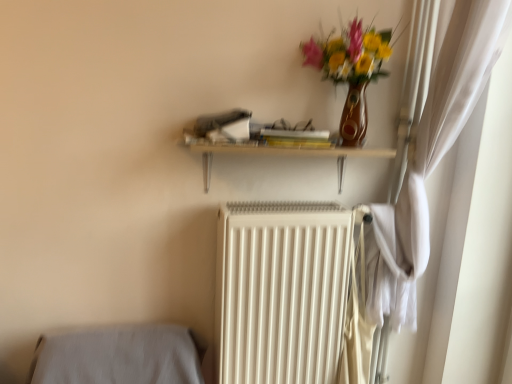
What is the approximate height of white matte radiator at center?

It is 30.66 inches.

What is the approximate height of wooden shelf at upper center?

It is 8.64 inches.

Identify the location of matte brown vase with flowers at upper right. This screenshot has height=384, width=512. (351, 71).

Image resolution: width=512 pixels, height=384 pixels. I want to click on white matte radiator at center, so click(x=284, y=292).

Considering the sizes of objects wooden shelf at upper center and matte brown vase with flowers at upper right in the image provided, who is taller, wooden shelf at upper center or matte brown vase with flowers at upper right?

matte brown vase with flowers at upper right is taller.

Is matte brown vase with flowers at upper right at the back of wooden shelf at upper center?

No, wooden shelf at upper center is not facing away from matte brown vase with flowers at upper right.

Is wooden shelf at upper center smaller than matte brown vase with flowers at upper right?

No.

From a real-world perspective, is wooden shelf at upper center beneath matte brown vase with flowers at upper right?

Correct, in the physical world, wooden shelf at upper center is lower than matte brown vase with flowers at upper right.

Does matte brown vase with flowers at upper right appear on the right side of white matte radiator at center?

Yes.

From the image's perspective, is matte brown vase with flowers at upper right located above or below white matte radiator at center?

From the image's perspective, matte brown vase with flowers at upper right appears above white matte radiator at center.

In the scene shown: Can you tell me how much matte brown vase with flowers at upper right and white matte radiator at center differ in facing direction?

The angle between the facing direction of matte brown vase with flowers at upper right and the facing direction of white matte radiator at center is 0.84 degrees.

Can you confirm if matte brown vase with flowers at upper right is bigger than white matte radiator at center?

No, matte brown vase with flowers at upper right is not bigger than white matte radiator at center.

Would you say matte brown vase with flowers at upper right is inside or outside wooden shelf at upper center?

matte brown vase with flowers at upper right is outside wooden shelf at upper center.

From the image's perspective, does matte brown vase with flowers at upper right appear lower than wooden shelf at upper center?

Incorrect, from the image's perspective, matte brown vase with flowers at upper right is higher than wooden shelf at upper center.

How different are the orientations of matte brown vase with flowers at upper right and wooden shelf at upper center in degrees?

0.84 degrees.

Considering the relative sizes of matte brown vase with flowers at upper right and wooden shelf at upper center in the image provided, is matte brown vase with flowers at upper right thinner than wooden shelf at upper center?

Incorrect, the width of matte brown vase with flowers at upper right is not less than that of wooden shelf at upper center.

Who is taller, wooden shelf at upper center or white matte radiator at center?

white matte radiator at center.

From a real-world perspective, which is physically below, wooden shelf at upper center or white matte radiator at center?

white matte radiator at center is physically lower.

From the picture: What's the angular difference between wooden shelf at upper center and white matte radiator at center's facing directions?

They differ by 0.000405 degrees in their facing directions.

From the image's perspective, between wooden shelf at upper center and white matte radiator at center, who is located below?

white matte radiator at center is shown below in the image.

Is white matte radiator at center located outside wooden shelf at upper center?

Indeed, white matte radiator at center is completely outside wooden shelf at upper center.

Can you confirm if white matte radiator at center is taller than wooden shelf at upper center?

Indeed, white matte radiator at center has a greater height compared to wooden shelf at upper center.

Is white matte radiator at center positioned far away from wooden shelf at upper center?

No, white matte radiator at center is not far from wooden shelf at upper center.

Between white matte radiator at center and wooden shelf at upper center, which one appears on the right side from the viewer's perspective?

white matte radiator at center.

Considering the positions of point (325, 316) and point (373, 45), is point (325, 316) closer or farther from the camera than point (373, 45)?

Point (325, 316).

Considering the relative positions of white matte radiator at center and matte brown vase with flowers at upper right in the image provided, is white matte radiator at center to the left or to the right of matte brown vase with flowers at upper right?

Clearly, white matte radiator at center is on the left of matte brown vase with flowers at upper right in the image.

Which object is further away from the camera, white matte radiator at center or matte brown vase with flowers at upper right?

white matte radiator at center is further from the camera.

Identify the location of shelf that appears below the matte brown vase with flowers at upper right (from the image's perspective). The image size is (512, 384). (280, 151).

At what (x,y) coordinates should I click in order to perform the action: click on radiator that is on the left side of matte brown vase with flowers at upper right. Please return your answer as a coordinate pair (x, y). Image resolution: width=512 pixels, height=384 pixels. Looking at the image, I should click on (284, 292).

When comparing their distances from wooden shelf at upper center, does matte brown vase with flowers at upper right or white matte radiator at center seem further?

white matte radiator at center.

Estimate the real-world distances between objects in this image. Which object is further from matte brown vase with flowers at upper right, wooden shelf at upper center or white matte radiator at center?

Among the two, white matte radiator at center is located further to matte brown vase with flowers at upper right.

When comparing their distances from matte brown vase with flowers at upper right, does white matte radiator at center or wooden shelf at upper center seem closer?

The object closer to matte brown vase with flowers at upper right is wooden shelf at upper center.

Looking at the image, which one is located further to wooden shelf at upper center, white matte radiator at center or matte brown vase with flowers at upper right?

white matte radiator at center lies further to wooden shelf at upper center than the other object.

When comparing their distances from white matte radiator at center, does wooden shelf at upper center or matte brown vase with flowers at upper right seem closer?

wooden shelf at upper center is positioned closer to the anchor white matte radiator at center.

Looking at this image, which object lies further to the anchor point white matte radiator at center, matte brown vase with flowers at upper right or wooden shelf at upper center?

matte brown vase with flowers at upper right is further to white matte radiator at center.

Locate an element on the screen. Image resolution: width=512 pixels, height=384 pixels. shelf that lies between matte brown vase with flowers at upper right and white matte radiator at center from top to bottom is located at coordinates (280, 151).